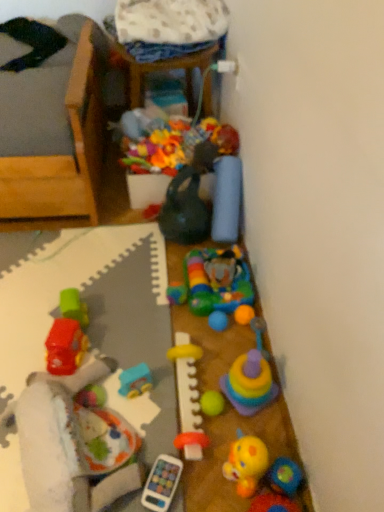
Locate an element on the screen. The image size is (384, 512). free point in front of orange rubber ball at center-right, the 10th toy from the left is located at coordinates (230, 362).